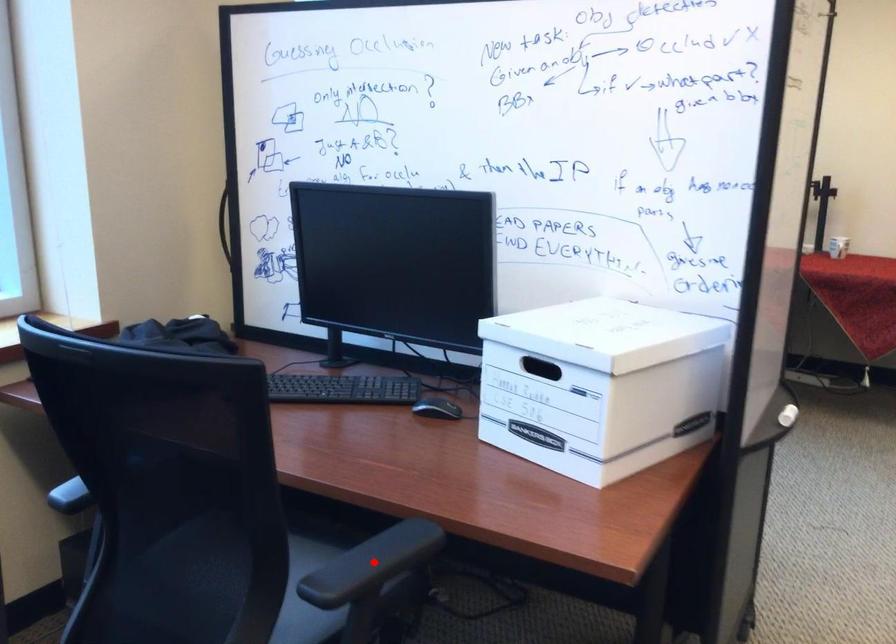
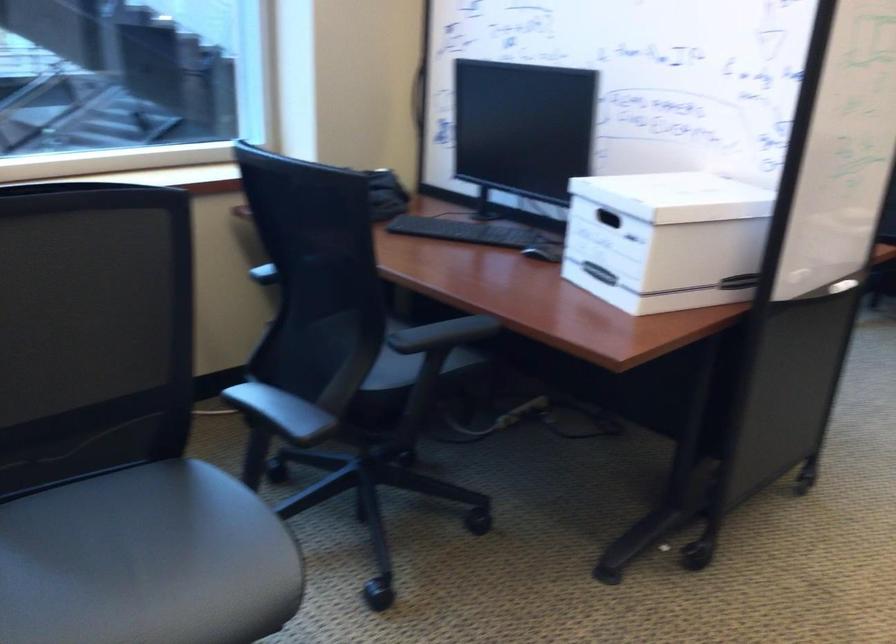
Question: A red point is marked in image1. In image2, is the corresponding 3D point closer to the camera or farther? Reply with the corresponding letter.

Choices:
 (A) The corresponding 3D point is closer.
 (B) The corresponding 3D point is farther.

Answer: (B)